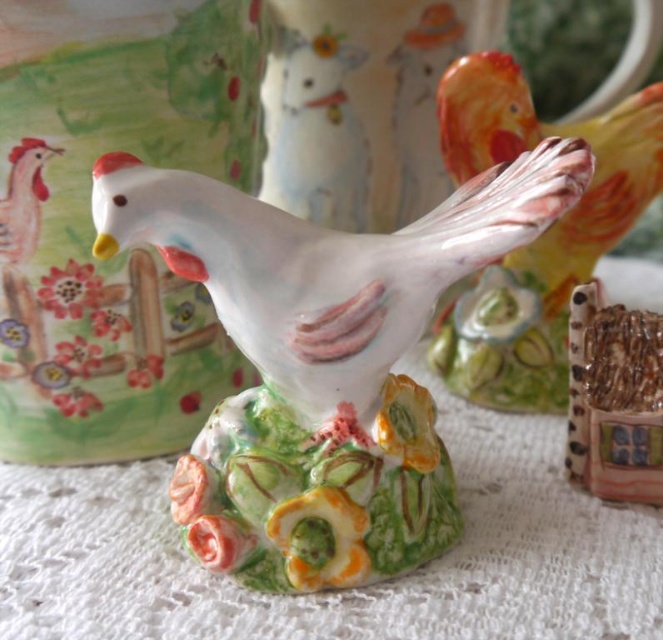
Question: In this image, where is white glossy ceramic chicken at center located relative to porcelain glossy chicken at upper right?

Choices:
 (A) above
 (B) below

Answer: (B)

Question: Does white glossy ceramic chicken at center have a smaller size compared to porcelain glossy chicken at upper right?

Choices:
 (A) yes
 (B) no

Answer: (B)

Question: Can you confirm if white glossy ceramic chicken at center is positioned to the left of porcelain glossy chicken at upper right?

Choices:
 (A) no
 (B) yes

Answer: (B)